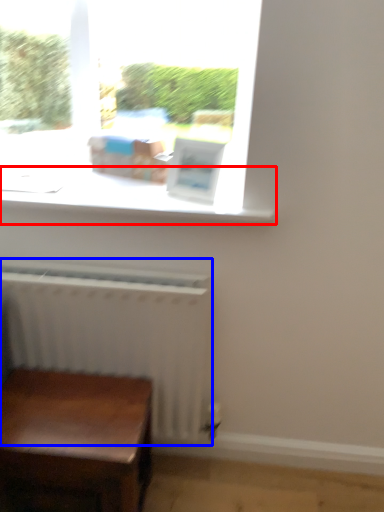
Question: Which object is closer to the camera taking this photo, window sill (highlighted by a red box) or radiator (highlighted by a blue box)?

Choices:
 (A) window sill
 (B) radiator

Answer: (A)